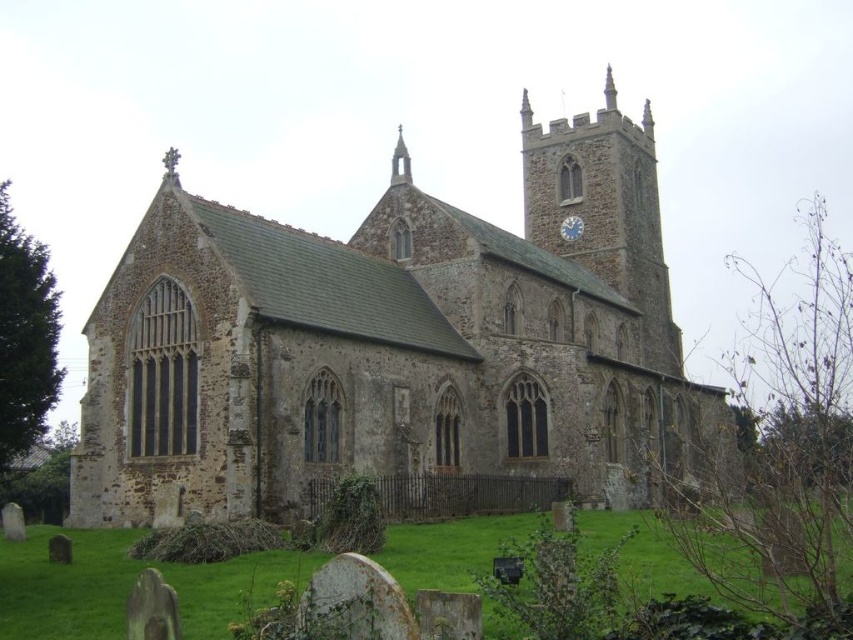
You are standing in a field and see the brown stone church at center in the distance. Based on its position, can you estimate its coordinates relative to your current position?

The brown stone church at center is located at coordinates approximately 0.536 along the x axis and 0.463 along the y axis relative to your current position.